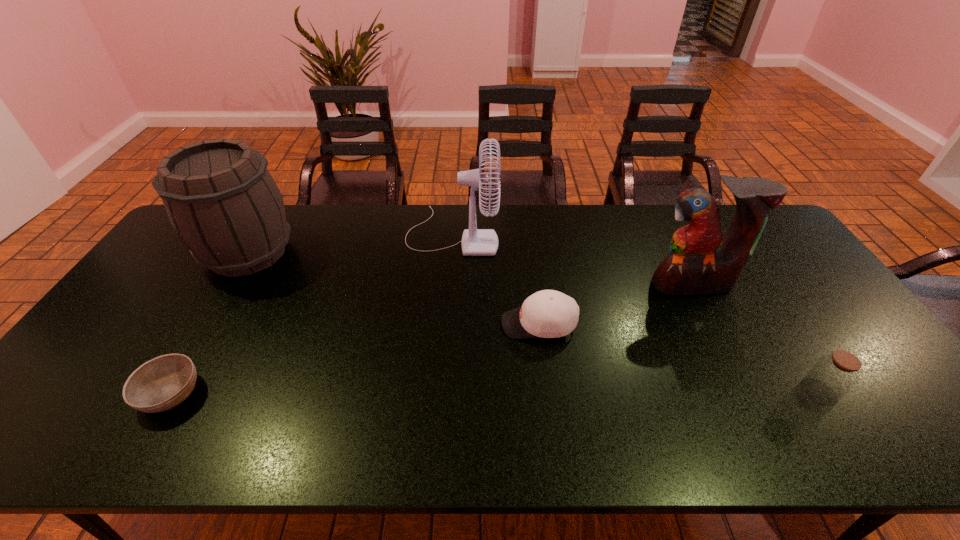
Where is `vacant point located on the left of the wine bucket`? This screenshot has width=960, height=540. vacant point located on the left of the wine bucket is located at coordinates [173, 252].

What are the coordinates of `vacant region located on the right of the jar` in the screenshot? It's located at (890, 392).

Find the location of a particular element. The width and height of the screenshot is (960, 540). free spot located 0.190m on the front-facing side of the baseball cap is located at coordinates (432, 324).

Locate an element on the screen. free space located on the front-facing side of the baseball cap is located at coordinates (461, 324).

Locate an element on the screen. The image size is (960, 540). blank space located 0.290m on the front-facing side of the baseball cap is located at coordinates [396, 324].

You are a GUI agent. You are given a task and a screenshot of the screen. Output one action in this format:
    pyautogui.click(x=<x>, y=<y>)
    Task: Click on the free location located 0.130m on the right of the bowl
    The width and height of the screenshot is (960, 540).
    Given the screenshot: What is the action you would take?
    pyautogui.click(x=255, y=393)

Where is `fan at the far edge`? The height and width of the screenshot is (540, 960). fan at the far edge is located at coordinates [475, 242].

Locate an element on the screen. Image resolution: width=960 pixels, height=540 pixels. wine bucket that is at the far edge is located at coordinates (220, 198).

Locate an element on the screen. This screenshot has height=540, width=960. object located in the near edge section of the desktop is located at coordinates (162, 383).

Identify the location of object present at the left edge. The width and height of the screenshot is (960, 540). (220, 198).